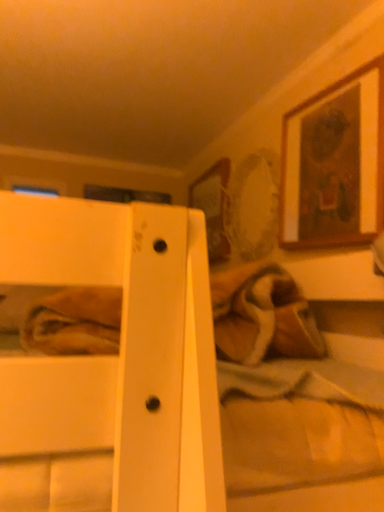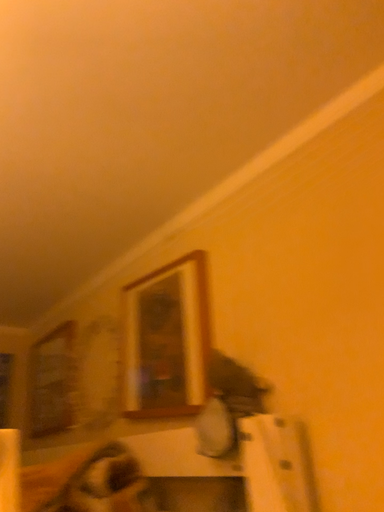
Question: Which way did the camera rotate in the video?

Choices:
 (A) rotated left
 (B) rotated right

Answer: (B)